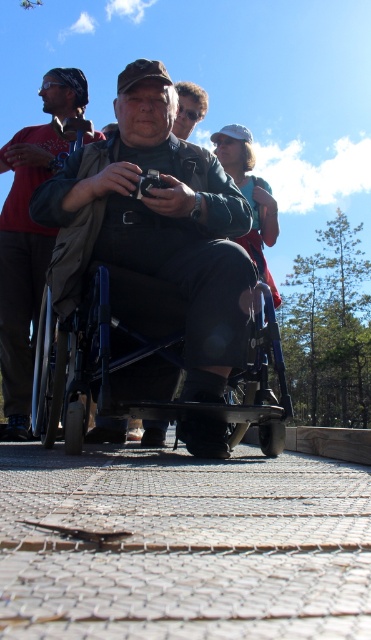
Looking at this image, you are a photographer trying to capture a group photo of the people in the scene. The metallic blue wheelchair at center and the brown leather jacket at upper left are both in your viewfinder. Which object should you adjust your camera angle to include first if you want both to be fully visible?

The metallic blue wheelchair at center is located below the brown leather jacket at upper left, so you should adjust your camera angle to include the brown leather jacket at upper left first by tilting the camera upward slightly.

You are a photographer standing 20 inches away from the matte black wheelchair at center. You want to take a picture of the metallic blue wheelchair at center without moving your position. Can you fit both wheelchairs in the frame if your camera has a 15 inch wide field of view?

The distance between the matte black wheelchair at center and the metallic blue wheelchair at center is 15.53 inches. Since your camera has a 15 inch wide field of view and you are 20 inches away, the field of view might not be wide enough to capture both wheelchairs simultaneously. You may need to adjust your position or use a wider lens.

Looking at this image, you are standing in front of the scene and want to determine which of the two points, point (228, 364) or point (258, 429), is nearer to you. Based on the spatial information provided, which point is closer?

Point (228, 364) is closer to the viewer than point (258, 429).